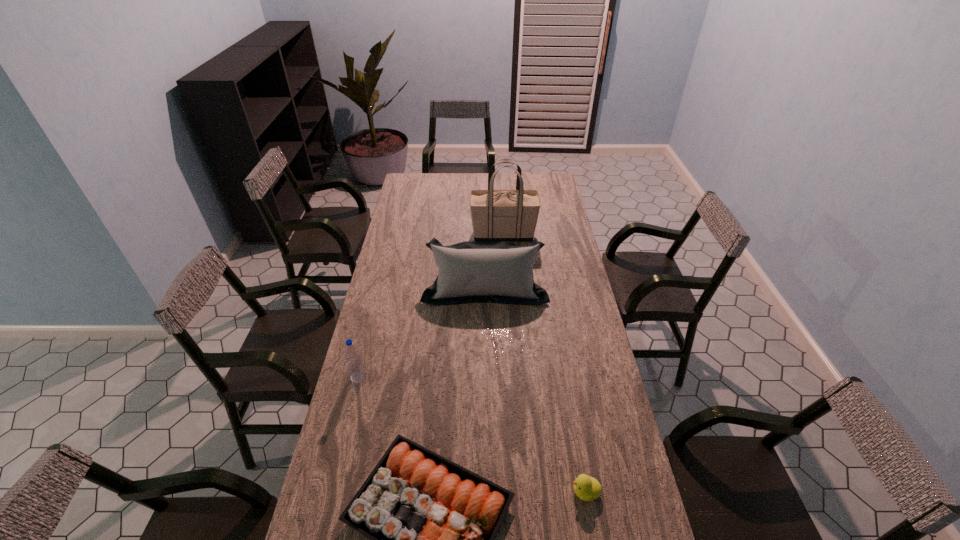
The image size is (960, 540). What are the coordinates of `blank space located 0.390m on the right of the leftmost object` in the screenshot? It's located at (477, 377).

I want to click on vacant space situated at the beak of the second shortest object, so click(x=536, y=491).

I want to click on vacant region located 0.240m at the beak of the second shortest object, so click(x=487, y=491).

I want to click on free space located at the beak of the second shortest object, so click(x=434, y=491).

At what (x,y) coordinates should I click in order to perform the action: click on object present at the left edge. Please return your answer as a coordinate pair (x, y). The width and height of the screenshot is (960, 540). Looking at the image, I should click on [x=355, y=365].

Find the location of `cushion that is at the right edge`. cushion that is at the right edge is located at coordinates (472, 271).

Find the location of a particular element. duckling located in the right edge section of the desktop is located at coordinates (587, 488).

In the image, there is a desktop. Identify the location of blank space at the far edge. Image resolution: width=960 pixels, height=540 pixels. (469, 194).

Where is `vacant space at the left edge of the desktop`? The image size is (960, 540). vacant space at the left edge of the desktop is located at coordinates (426, 195).

Identify the location of vacant space at the right edge of the desktop. The width and height of the screenshot is (960, 540). (564, 375).